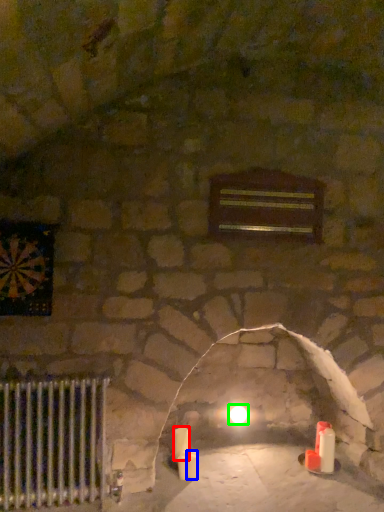
Question: Which object is the closest to the candle (highlighted by a red box)? Choose among these: candle (highlighted by a blue box) or glow (highlighted by a green box).

Choices:
 (A) candle
 (B) glow

Answer: (A)